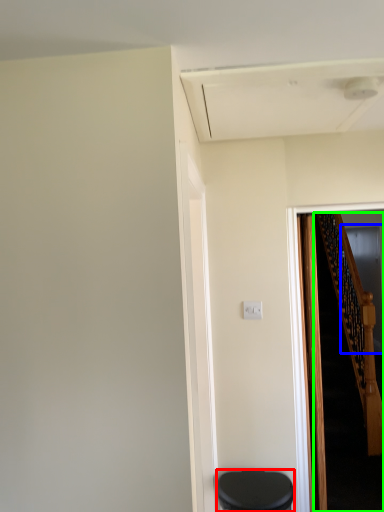
Question: Based on their relative distances, which object is nearer to furniture (highlighted by a red box)? Choose from glass door (highlighted by a blue box) and stairs (highlighted by a green box).

Choices:
 (A) glass door
 (B) stairs

Answer: (B)